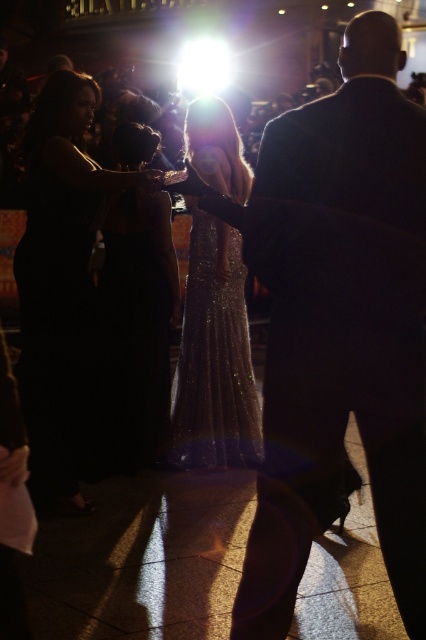
You are a photographer at the event and need to capture a group photo of the shiny black suit at center and the black sequined dress at left. Your camera has a minimum focus distance of 2 meters. Will you be able to take the photo without moving either of them?

The shiny black suit at center is 2.10 meters away from the black sequined dress at left. Since the distance is more than the camera minimum focus distance of 2 meters, you can take the photo without moving them.

You are a photographer at the event and need to capture a photo that includes both the black satin dress at left and the sparkly gold dress at center. Since you want to ensure both are in focus, which dress should you focus on first to maximize the depth of field?

The black satin dress at left is closer to the viewer than the sparkly gold dress at center. To maximize depth of field, focus on the sparkly gold dress at center because it is farther away, allowing both subjects to be in focus.

In the scene shown: You are at a gala event and need to locate two guests. The shiny black suit at center and the black sequined dress at left are in the scene. Which guest is positioned to the right of the other?

The shiny black suit at center is positioned to the right of the black sequined dress at left.